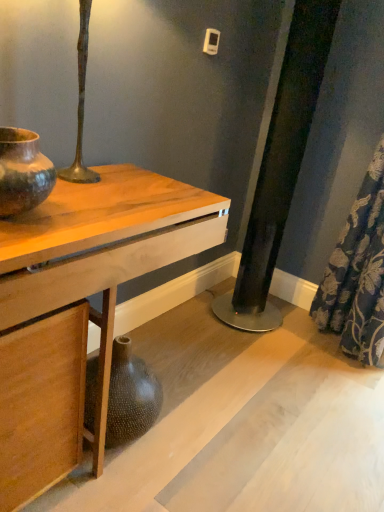
You are a GUI agent. You are given a task and a screenshot of the screen. Output one action in this format:
    pyautogui.click(x=<x>, y=<y>)
    Task: Click on the blank space above wooden table at center (from a real-world perspective)
    The height and width of the screenshot is (512, 384).
    Given the screenshot: What is the action you would take?
    pyautogui.click(x=105, y=200)